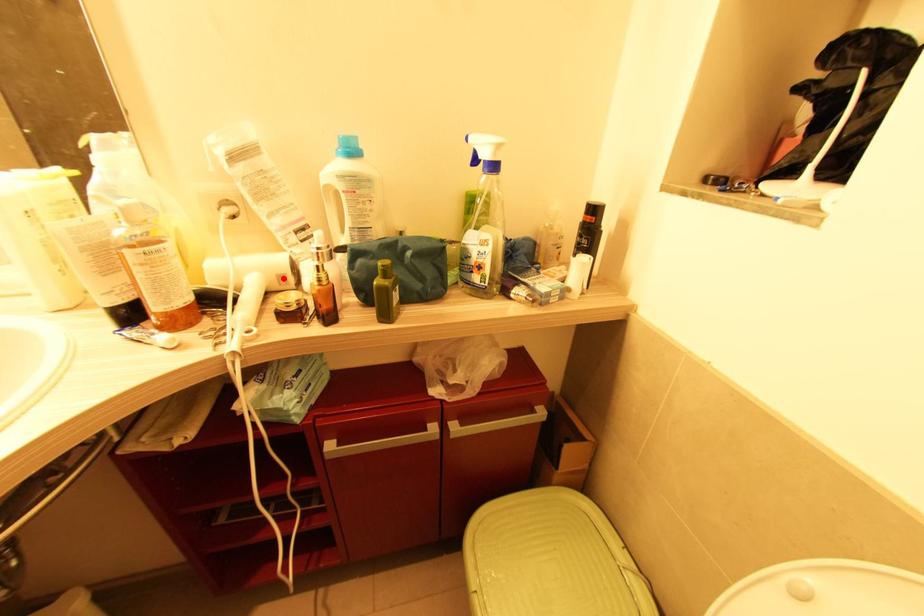
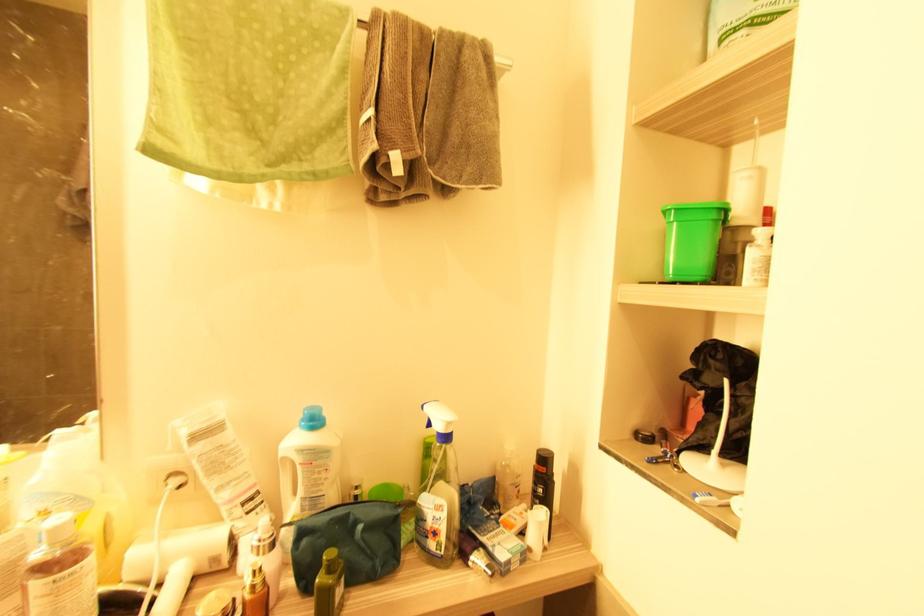
The point at the highlighted location is marked in the first image. Where is the corresponding point in the second image?

(216, 561)